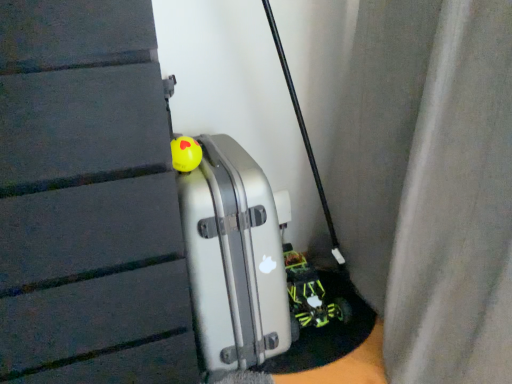
The image size is (512, 384). Describe the element at coordinates (185, 154) in the screenshot. I see `yellow rubber ball at center` at that location.

Where is `yellow rubber ball at center`? The height and width of the screenshot is (384, 512). yellow rubber ball at center is located at coordinates (185, 154).

In terms of height, does silver metallic suitcase at center look taller or shorter compared to neon green plastic toy car at lower right?

Considering their sizes, silver metallic suitcase at center has more height than neon green plastic toy car at lower right.

Is silver metallic suitcase at center closer to the viewer compared to neon green plastic toy car at lower right?

That is True.

Does point (261, 289) come in front of point (346, 300)?

Yes, it is.

How different are the orientations of silver metallic suitcase at center and neon green plastic toy car at lower right in degrees?

There is a 0.000289-degree angle between the facing directions of silver metallic suitcase at center and neon green plastic toy car at lower right.

Is silver metallic suitcase at center turned away from yellow rubber ball at center?

That's not correct — silver metallic suitcase at center is not looking away from yellow rubber ball at center.

Which of these two, silver metallic suitcase at center or yellow rubber ball at center, stands shorter?

yellow rubber ball at center is shorter.

Does point (212, 290) lie in front of point (193, 168)?

That is False.

I want to click on toy car on the right of silver metallic suitcase at center, so click(310, 294).

Is the depth of neon green plastic toy car at lower right greater than that of silver metallic suitcase at center?

That is True.

From the picture: Is silver metallic suitcase at center a part of neon green plastic toy car at lower right?

Actually, silver metallic suitcase at center is outside neon green plastic toy car at lower right.

Does neon green plastic toy car at lower right have a greater width compared to yellow rubber ball at center?

Correct, the width of neon green plastic toy car at lower right exceeds that of yellow rubber ball at center.

Identify the location of toy car on the right side of yellow rubber ball at center. (310, 294).

Considering the sizes of objects neon green plastic toy car at lower right and yellow rubber ball at center in the image provided, who is shorter, neon green plastic toy car at lower right or yellow rubber ball at center?

yellow rubber ball at center is shorter.

Does neon green plastic toy car at lower right come behind yellow rubber ball at center?

Yes, it is.

Between yellow rubber ball at center and neon green plastic toy car at lower right, which one has larger size?

neon green plastic toy car at lower right is bigger.

Between yellow rubber ball at center and neon green plastic toy car at lower right, which one appears on the right side from the viewer's perspective?

Positioned to the right is neon green plastic toy car at lower right.

Measure the distance from yellow rubber ball at center to neon green plastic toy car at lower right.

yellow rubber ball at center is 27.71 inches from neon green plastic toy car at lower right.

Who is taller, yellow rubber ball at center or neon green plastic toy car at lower right?

neon green plastic toy car at lower right.

Consider the image. Between yellow rubber ball at center and silver metallic suitcase at center, which one has more height?

With more height is silver metallic suitcase at center.

Which is in front, point (180, 155) or point (196, 285)?

The point (180, 155) is closer.

From the image's perspective, is yellow rubber ball at center below silver metallic suitcase at center?

No, from the image's perspective, yellow rubber ball at center is not beneath silver metallic suitcase at center.

Based on their sizes in the image, would you say yellow rubber ball at center is bigger or smaller than silver metallic suitcase at center?

In the image, yellow rubber ball at center appears to be smaller than silver metallic suitcase at center.

In the image, there is a silver metallic suitcase at center. At what (x,y) coordinates should I click in order to perform the action: click on toy car below it (from the image's perspective). Please return your answer as a coordinate pair (x, y). The width and height of the screenshot is (512, 384). Looking at the image, I should click on (310, 294).

In the image, there is a yellow rubber ball at center. Identify the location of luggage below it (from a real-world perspective). (234, 258).

Based on their spatial positions, is silver metallic suitcase at center or neon green plastic toy car at lower right further from yellow rubber ball at center?

neon green plastic toy car at lower right.

From the image, which object appears to be nearer to yellow rubber ball at center, neon green plastic toy car at lower right or silver metallic suitcase at center?

Among the two, silver metallic suitcase at center is located nearer to yellow rubber ball at center.

When comparing their distances from neon green plastic toy car at lower right, does silver metallic suitcase at center or yellow rubber ball at center seem closer?

silver metallic suitcase at center.

Considering their positions, is neon green plastic toy car at lower right positioned closer to silver metallic suitcase at center than yellow rubber ball at center?

yellow rubber ball at center.

Consider the image. Estimate the real-world distances between objects in this image. Which object is closer to silver metallic suitcase at center, yellow rubber ball at center or neon green plastic toy car at lower right?

yellow rubber ball at center.

Looking at the image, which one is located closer to neon green plastic toy car at lower right, yellow rubber ball at center or silver metallic suitcase at center?

Based on the image, silver metallic suitcase at center appears to be nearer to neon green plastic toy car at lower right.

Where is `toy between silver metallic suitcase at center and neon green plastic toy car at lower right in the front-back direction`? This screenshot has width=512, height=384. toy between silver metallic suitcase at center and neon green plastic toy car at lower right in the front-back direction is located at coordinates (185, 154).